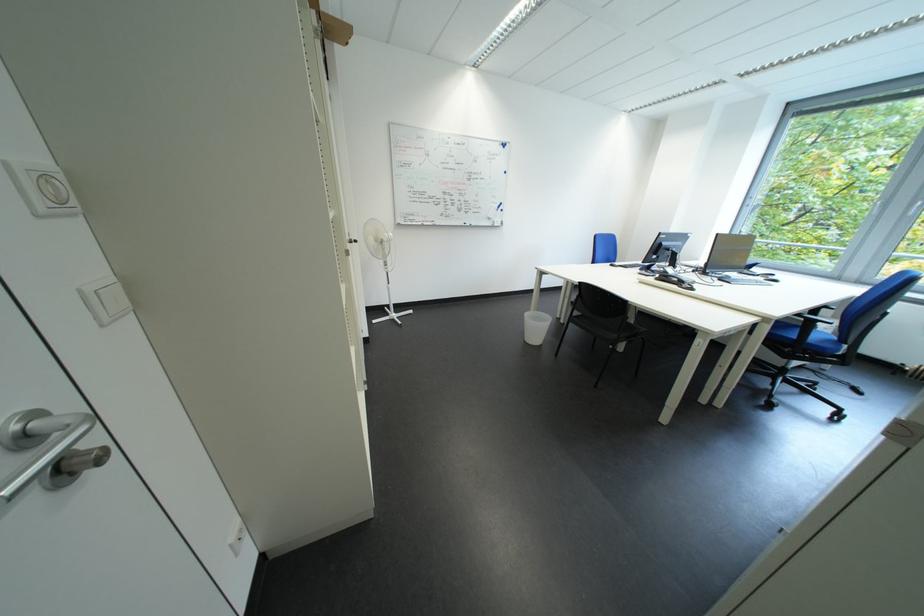
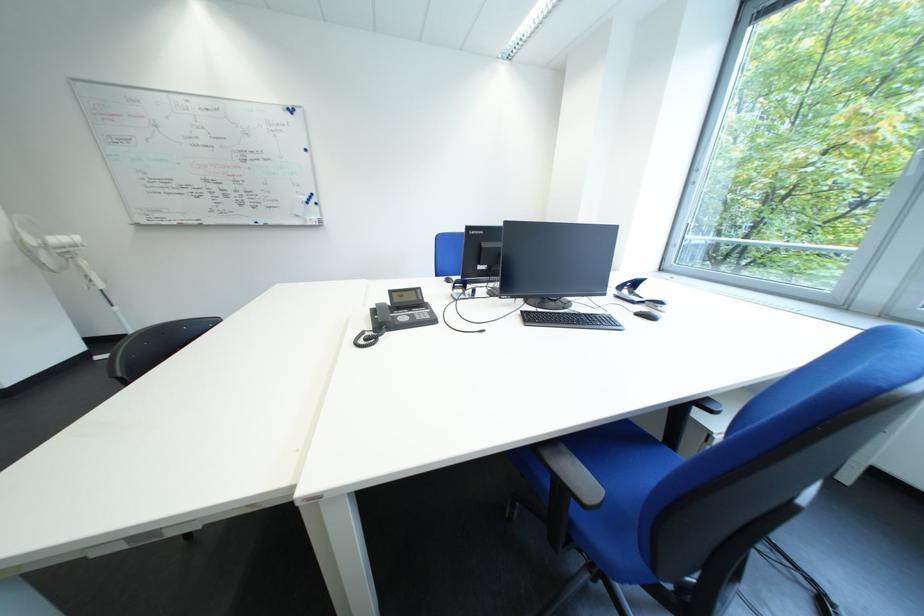
Where in the second image is the point corresponding to (415,225) from the first image?

(157, 225)